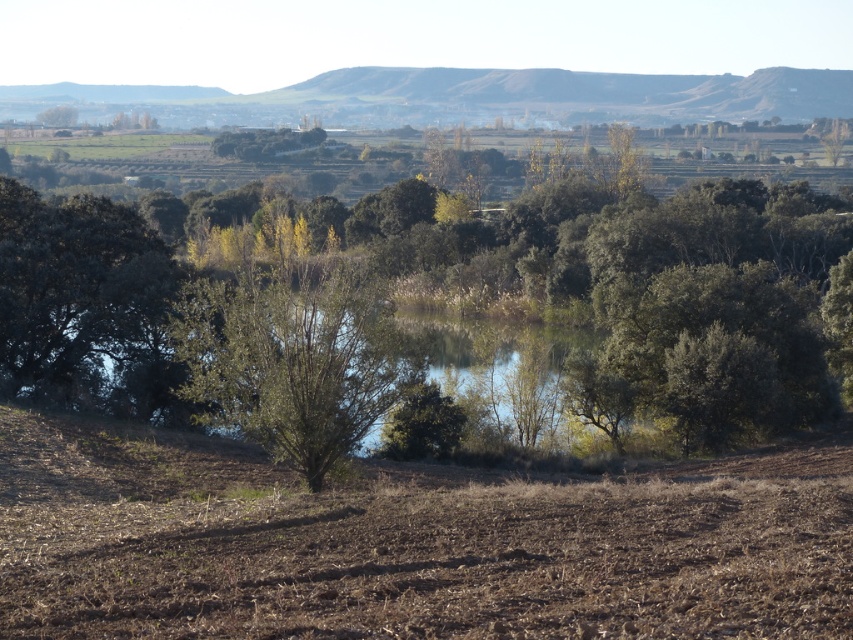
Question: Can you confirm if green leafy tree at center is thinner than brown soil at lower center?

Choices:
 (A) no
 (B) yes

Answer: (A)

Question: Which point is closer to the camera taking this photo?

Choices:
 (A) (45, 116)
 (B) (799, 465)
 (C) (113, 312)

Answer: (B)

Question: Is green leafy tree at center below brown soil at lower center?

Choices:
 (A) no
 (B) yes

Answer: (A)

Question: Is green leafy tree at center further to camera compared to brown soil at lower center?

Choices:
 (A) yes
 (B) no

Answer: (A)

Question: Among these points, which one is nearest to the camera?

Choices:
 (A) (637, 556)
 (B) (131, 396)

Answer: (A)

Question: Which is nearer to the brown soil at lower center?

Choices:
 (A) green matte tree at left
 (B) green leafy tree at center
 (C) green leafy tree at upper left

Answer: (A)